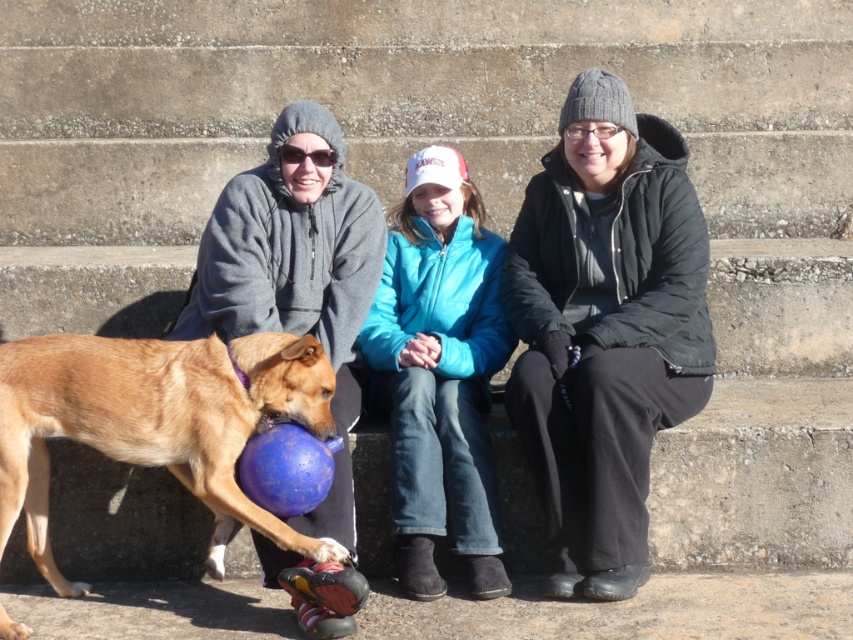
Question: Estimate the real-world distances between objects in this image. Which object is farther from the black fuzzy jacket at center?

Choices:
 (A) brown fur dog at center
 (B) matte gray hoodie at center
 (C) gray fleece jacket at left

Answer: (A)

Question: Does matte gray hoodie at center come in front of brown fur dog at center?

Choices:
 (A) no
 (B) yes

Answer: (A)

Question: Does matte gray hoodie at center come behind gray fleece jacket at left?

Choices:
 (A) yes
 (B) no

Answer: (A)

Question: Does matte gray hoodie at center lie in front of brown fur dog at center?

Choices:
 (A) yes
 (B) no

Answer: (B)

Question: Which point is closer to the camera?

Choices:
 (A) blue fleece jacket at center
 (B) black fuzzy jacket at center
 (C) matte gray hoodie at center
 (D) gray fleece jacket at left

Answer: (D)

Question: Which object is closer to the camera taking this photo?

Choices:
 (A) blue fleece jacket at center
 (B) black fuzzy jacket at center

Answer: (B)